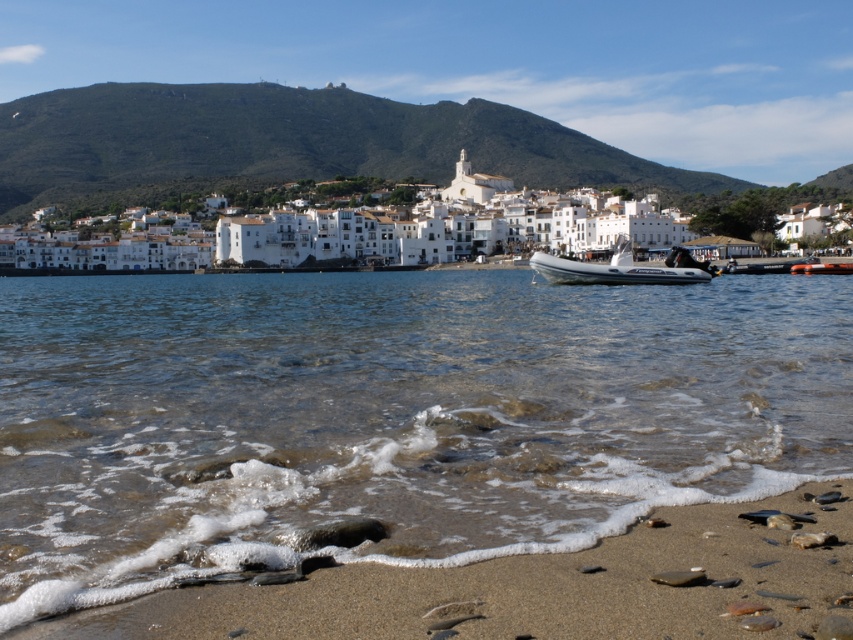
Question: Does clear water at beach center appear on the left side of sandy brown at lower center?

Choices:
 (A) yes
 (B) no

Answer: (A)

Question: Among these points, which one is farthest from the camera?

Choices:
 (A) (814, 180)
 (B) (827, 596)
 (C) (676, 280)

Answer: (A)

Question: Among these points, which one is nearest to the camera?

Choices:
 (A) (575, 269)
 (B) (836, 177)
 (C) (86, 634)
 (D) (762, 280)

Answer: (C)

Question: Among these objects, which one is farthest from the camera?

Choices:
 (A) clear water at beach center
 (B) white matte buildings at center
 (C) white rubber boat at center

Answer: (B)

Question: Can you confirm if sandy brown at lower center is thinner than white matte buildings at center?

Choices:
 (A) yes
 (B) no

Answer: (A)

Question: Observing the image, what is the correct spatial positioning of clear water at beach center in reference to white matte buildings at center?

Choices:
 (A) below
 (B) above

Answer: (A)